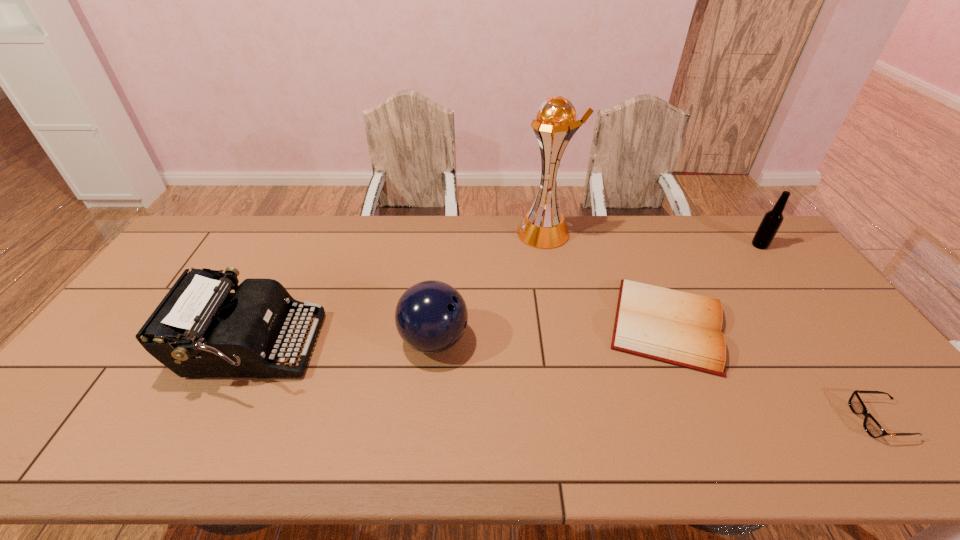
This screenshot has width=960, height=540. I want to click on beer bottle that is at the right edge, so click(x=772, y=220).

Identify the location of sunglasses that is at the right edge. (873, 428).

Find the location of a particular element. Image resolution: width=960 pixels, height=540 pixels. object present at the far right corner is located at coordinates (772, 220).

At what (x,y) coordinates should I click in order to perform the action: click on object that is at the near right corner. Please return your answer as a coordinate pair (x, y). Image resolution: width=960 pixels, height=540 pixels. Looking at the image, I should click on (873, 428).

In the image, there is a desktop. Where is `vacant space at the far edge`? The width and height of the screenshot is (960, 540). vacant space at the far edge is located at coordinates 597,221.

The height and width of the screenshot is (540, 960). Find the location of `vacant space at the near edge of the desktop`. vacant space at the near edge of the desktop is located at coordinates (709, 440).

Find the location of a particular element. Image resolution: width=960 pixels, height=540 pixels. vacant space at the left edge is located at coordinates (96, 352).

Identify the location of vacant space at the right edge. The height and width of the screenshot is (540, 960). (857, 421).

The image size is (960, 540). Find the location of `free space that is in between the bowling ball and the beer bottle`. free space that is in between the bowling ball and the beer bottle is located at coordinates (597, 293).

You are a GUI agent. You are given a task and a screenshot of the screen. Output one action in this format:
    pyautogui.click(x=<x>, y=<y>)
    Task: Click on the vacant space that's between the third object from left to right and the typewriter
    
    Given the screenshot: What is the action you would take?
    pyautogui.click(x=397, y=290)